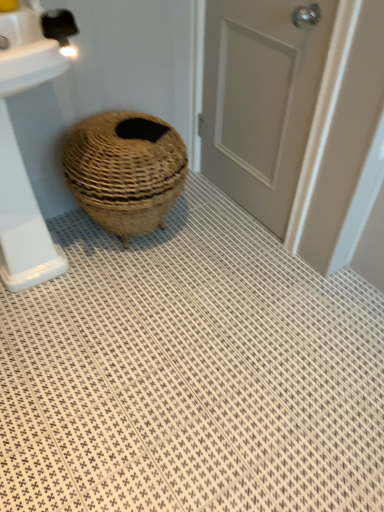
Image resolution: width=384 pixels, height=512 pixels. I want to click on vacant area that lies between matte gray door at center and natural woven basket at center, so click(205, 231).